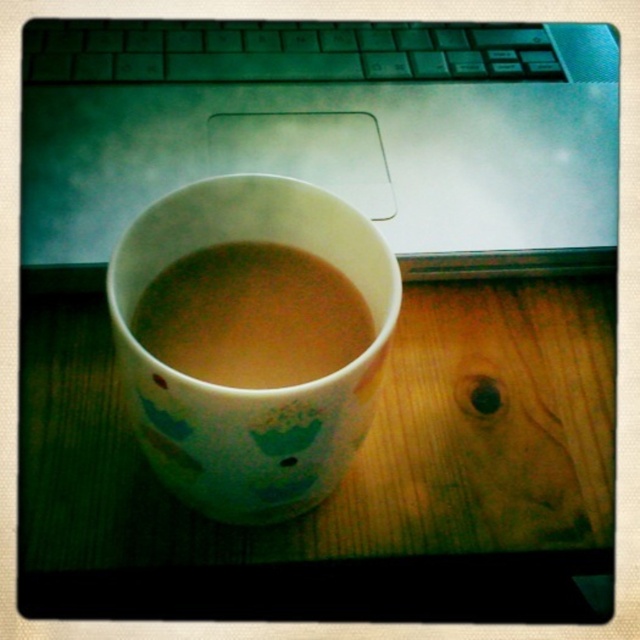
Which is behind, point (99, 588) or point (220, 435)?

The point (99, 588) is more distant.

Does white matte wood table at center appear on the right side of white glossy mug at center?

Yes, white matte wood table at center is to the right of white glossy mug at center.

Is point (86, 346) closer to camera compared to point (236, 236)?

That is False.

The image size is (640, 640). In order to click on white matte wood table at center in this screenshot , I will do `click(346, 474)`.

Looking at this image, does black plastic keyboard at upper center appear on the left side of brown matte cup at center?

In fact, black plastic keyboard at upper center is to the right of brown matte cup at center.

Which is more to the left, black plastic keyboard at upper center or brown matte cup at center?

brown matte cup at center is more to the left.

Is point (352, 49) positioned after point (262, 257)?

Yes, it is behind point (262, 257).

Locate an element on the screen. Image resolution: width=640 pixels, height=640 pixels. black plastic keyboard at upper center is located at coordinates (282, 51).

Which is in front, point (182, 106) or point (362, 392)?

Point (362, 392)

Can you confirm if sleek silver laptop at upper center is wider than white glossy mug at center?

Yes, sleek silver laptop at upper center is wider than white glossy mug at center.

Does point (52, 93) come in front of point (138, 392)?

No, it is not.

Find the location of a particular element. This screenshot has width=640, height=640. sleek silver laptop at upper center is located at coordinates (330, 113).